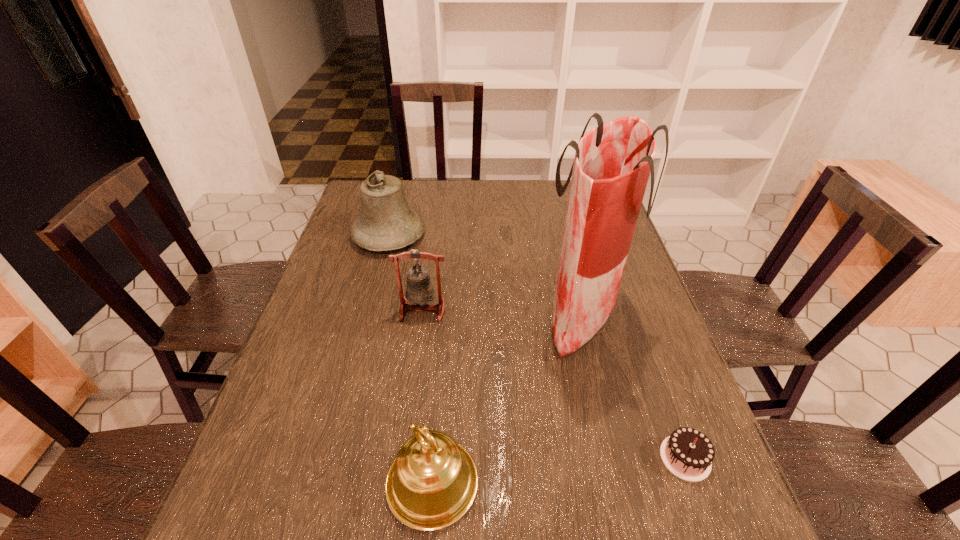
Select which bell appears as the closest to the second nearest bell. Please provide its 2D coordinates. Your answer should be formatted as a tuple, i.e. [(x, y)], where the tuple contains the x and y coordinates of a point satisfying the conditions above.

[(386, 222)]

Where is `vacant region that satisfies the following two spatial constraints: 1. on the back side of the shortest object; 2. on the left side of the nearest bell`? This screenshot has width=960, height=540. vacant region that satisfies the following two spatial constraints: 1. on the back side of the shortest object; 2. on the left side of the nearest bell is located at coordinates (434, 458).

The height and width of the screenshot is (540, 960). In order to click on free space that satisfies the following two spatial constraints: 1. on the back side of the nearest bell; 2. on the right side of the shortest object in this screenshot , I will do `click(434, 458)`.